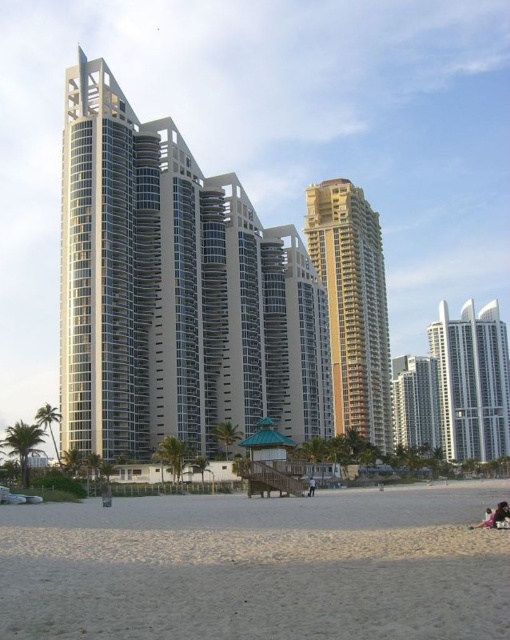
Looking at this image, is beige glass building at center to the left of smooth glass building at center from the viewer's perspective?

Indeed, beige glass building at center is positioned on the left side of smooth glass building at center.

Between point (320, 346) and point (410, 417), which one is positioned behind?

Positioned behind is point (410, 417).

Does point (94, 150) come in front of point (410, 410)?

Yes.

At what (x,y) coordinates should I click in order to perform the action: click on beige glass building at center. Please return your answer as a coordinate pair (x, y). Looking at the image, I should click on (174, 292).

Which is below, white sand at lower center or gold textured building at center?

white sand at lower center is lower down.

Can you confirm if white sand at lower center is positioned above gold textured building at center?

No, white sand at lower center is not above gold textured building at center.

Does point (134, 561) lie behind point (336, 316)?

No, it is in front of (336, 316).

Locate an element on the screen. The height and width of the screenshot is (640, 510). white sand at lower center is located at coordinates (257, 568).

Is gold textured building at center above dark blue jeans at center?

Correct, gold textured building at center is located above dark blue jeans at center.

Is gold textured building at center wider than dark blue jeans at center?

Correct, the width of gold textured building at center exceeds that of dark blue jeans at center.

This screenshot has width=510, height=640. Identify the location of gold textured building at center. (352, 307).

Find the location of `gold textured building at center`. gold textured building at center is located at coordinates pos(352,307).